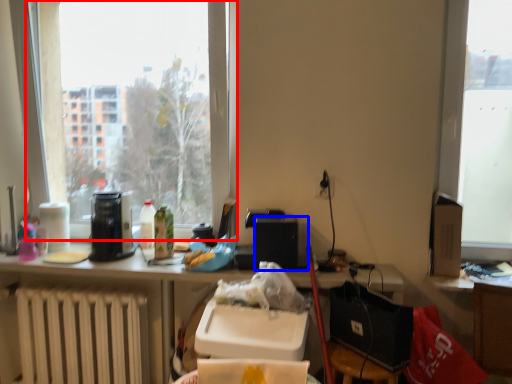
Question: Which object is further to the camera taking this photo, window (highlighted by a red box) or loudspeaker (highlighted by a blue box)?

Choices:
 (A) window
 (B) loudspeaker

Answer: (A)